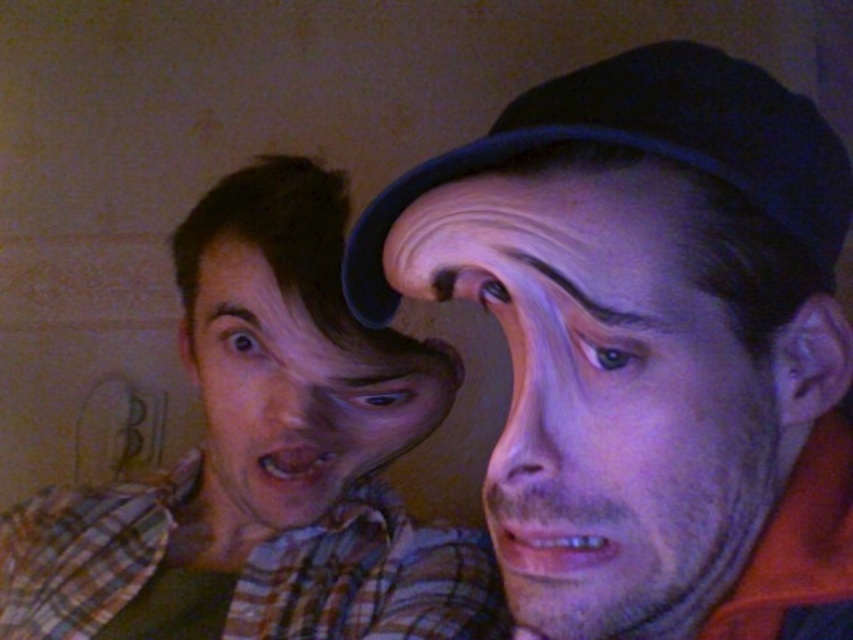
You are an artist trying to paint the scene described. You need to place the purple matte face at center precisely on your canvas. According to the coordinates provided, where should you position it relative to the bottom left corner of the canvas?

The purple matte face at center should be positioned at coordinates approximately 61.9 percent horizontally and 71.2 percent vertically from the bottom left corner of the canvas.

Based on the scene description, where is the plaid shirt at left located in terms of its 2D coordinates?

The plaid shirt at left is located at the 2D coordinates of point [264,460].